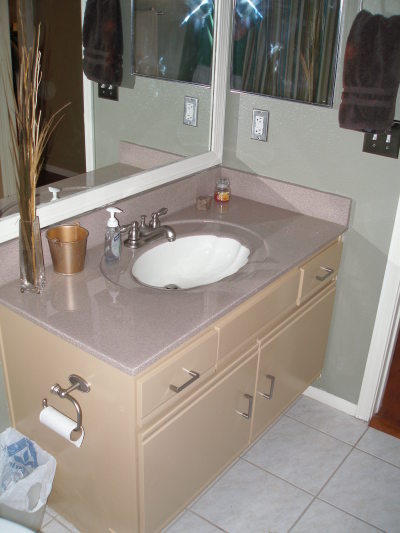
The image size is (400, 533). What are the coordinates of `liquid hand soap` in the screenshot? It's located at (110, 236).